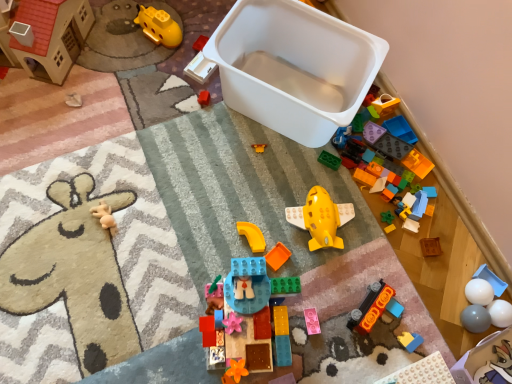
This screenshot has width=512, height=384. I want to click on vacant space in between white plastic storage box at upper center, the 1th storage box when ordered from left to right, and yellow matte airplane at center, the 8th toy from the left, so click(x=280, y=176).